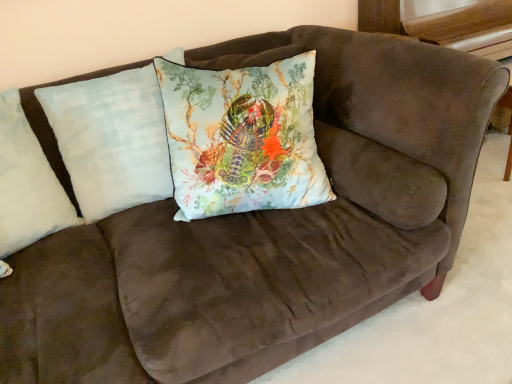
Image resolution: width=512 pixels, height=384 pixels. Identify the location of light blue fabric pillow at center, arranged as the 2th pillow when viewed from the right. (111, 140).

This screenshot has height=384, width=512. Describe the element at coordinates (242, 138) in the screenshot. I see `light blue fabric pillow at center, the third pillow in the left-to-right sequence` at that location.

Find the location of a particular element. Image resolution: width=512 pixels, height=384 pixels. white soft pillow at left, the first pillow viewed from the left is located at coordinates [x=26, y=185].

Can you confirm if light blue fabric pillow at center, arranged as the 2th pillow when viewed from the right, is bigger than white soft pillow at left, arranged as the third pillow when viewed from the right?

Indeed, light blue fabric pillow at center, arranged as the 2th pillow when viewed from the right, has a larger size compared to white soft pillow at left, arranged as the third pillow when viewed from the right.

From the image's perspective, would you say light blue fabric pillow at center, arranged as the 2th pillow when viewed from the right, is positioned over white soft pillow at left, the first pillow viewed from the left?

Yes, from the image's perspective, light blue fabric pillow at center, arranged as the 2th pillow when viewed from the right, is on top of white soft pillow at left, the first pillow viewed from the left.

How different are the orientations of light blue fabric pillow at center, the first pillow viewed from the right, and white soft pillow at left, arranged as the third pillow when viewed from the right, in degrees?

There is a 38.1-degree angle between the facing directions of light blue fabric pillow at center, the first pillow viewed from the right, and white soft pillow at left, arranged as the third pillow when viewed from the right.

Who is more distant, light blue fabric pillow at center, the third pillow in the left-to-right sequence, or white soft pillow at left, the first pillow viewed from the left?

light blue fabric pillow at center, the third pillow in the left-to-right sequence, is further away from the camera.

Considering the relative sizes of light blue fabric pillow at center, the first pillow viewed from the right, and white soft pillow at left, arranged as the third pillow when viewed from the right, in the image provided, is light blue fabric pillow at center, the first pillow viewed from the right, bigger than white soft pillow at left, arranged as the third pillow when viewed from the right,?

Yes.

Which object is more forward, light blue fabric pillow at center, positioned as the second pillow in left-to-right order, or light blue fabric pillow at center, the first pillow viewed from the right?

light blue fabric pillow at center, the first pillow viewed from the right, is more forward.

Which object is positioned more to the left, light blue fabric pillow at center, positioned as the second pillow in left-to-right order, or light blue fabric pillow at center, the third pillow in the left-to-right sequence?

light blue fabric pillow at center, positioned as the second pillow in left-to-right order, is more to the left.

From their relative heights in the image, would you say light blue fabric pillow at center, arranged as the 2th pillow when viewed from the right, is taller or shorter than light blue fabric pillow at center, the first pillow viewed from the right?

light blue fabric pillow at center, arranged as the 2th pillow when viewed from the right, is taller than light blue fabric pillow at center, the first pillow viewed from the right.

Is light blue fabric pillow at center, positioned as the second pillow in left-to-right order, completely or partially outside of light blue fabric pillow at center, the third pillow in the left-to-right sequence?

light blue fabric pillow at center, positioned as the second pillow in left-to-right order, lies outside light blue fabric pillow at center, the third pillow in the left-to-right sequence,'s area.

From a real-world perspective, which object stands above the other?

In real-world perspective, white soft pillow at left, the first pillow viewed from the left, is above.

Is white soft pillow at left, the first pillow viewed from the left, not close to light blue fabric pillow at center, the third pillow in the left-to-right sequence?

No, white soft pillow at left, the first pillow viewed from the left, is not far away from light blue fabric pillow at center, the third pillow in the left-to-right sequence.

How many degrees apart are the facing directions of white soft pillow at left, the first pillow viewed from the left, and light blue fabric pillow at center, the first pillow viewed from the right?

white soft pillow at left, the first pillow viewed from the left, and light blue fabric pillow at center, the first pillow viewed from the right, are facing 38.1 degrees away from each other.

How far apart are white soft pillow at left, the first pillow viewed from the left, and light blue fabric pillow at center, the first pillow viewed from the right?

white soft pillow at left, the first pillow viewed from the left, and light blue fabric pillow at center, the first pillow viewed from the right, are 22.98 inches apart.

Which of these two, light blue fabric pillow at center, the first pillow viewed from the right, or light blue fabric pillow at center, arranged as the 2th pillow when viewed from the right, stands taller?

light blue fabric pillow at center, arranged as the 2th pillow when viewed from the right.

From the image's perspective, is light blue fabric pillow at center, the third pillow in the left-to-right sequence, positioned above or below light blue fabric pillow at center, positioned as the second pillow in left-to-right order?

From the image's perspective, light blue fabric pillow at center, the third pillow in the left-to-right sequence, appears below light blue fabric pillow at center, positioned as the second pillow in left-to-right order.

Is light blue fabric pillow at center, the first pillow viewed from the right, oriented towards light blue fabric pillow at center, arranged as the 2th pillow when viewed from the right?

No.

Is light blue fabric pillow at center, the first pillow viewed from the right, bigger than light blue fabric pillow at center, arranged as the 2th pillow when viewed from the right?

Yes, light blue fabric pillow at center, the first pillow viewed from the right, is bigger than light blue fabric pillow at center, arranged as the 2th pillow when viewed from the right.

From the picture: Could light blue fabric pillow at center, positioned as the second pillow in left-to-right order, be considered to be inside white soft pillow at left, the first pillow viewed from the left?

No, light blue fabric pillow at center, positioned as the second pillow in left-to-right order, is not surrounded by white soft pillow at left, the first pillow viewed from the left.

Is there a large distance between white soft pillow at left, arranged as the third pillow when viewed from the right, and light blue fabric pillow at center, positioned as the second pillow in left-to-right order?

No, white soft pillow at left, arranged as the third pillow when viewed from the right, is not far away from light blue fabric pillow at center, positioned as the second pillow in left-to-right order.

Can you confirm if white soft pillow at left, arranged as the third pillow when viewed from the right, is wider than light blue fabric pillow at center, positioned as the second pillow in left-to-right order?

Indeed, white soft pillow at left, arranged as the third pillow when viewed from the right, has a greater width compared to light blue fabric pillow at center, positioned as the second pillow in left-to-right order.

Is white soft pillow at left, the first pillow viewed from the left, in front of or behind light blue fabric pillow at center, positioned as the second pillow in left-to-right order, in the image?

white soft pillow at left, the first pillow viewed from the left, is positioned closer to the viewer than light blue fabric pillow at center, positioned as the second pillow in left-to-right order.

Where is `the 2nd pillow above the light blue fabric pillow at center, positioned as the second pillow in left-to-right order (from a real-world perspective)`? the 2nd pillow above the light blue fabric pillow at center, positioned as the second pillow in left-to-right order (from a real-world perspective) is located at coordinates (26, 185).

Starting from the white soft pillow at left, the first pillow viewed from the left, which pillow is the 2nd one to the right? Please provide its 2D coordinates.

[(242, 138)]

From the image, which object appears to be farther from white soft pillow at left, arranged as the third pillow when viewed from the right, light blue fabric pillow at center, positioned as the second pillow in left-to-right order, or light blue fabric pillow at center, the third pillow in the left-to-right sequence?

Based on the image, light blue fabric pillow at center, the third pillow in the left-to-right sequence, appears to be further to white soft pillow at left, arranged as the third pillow when viewed from the right.

Considering their positions, is light blue fabric pillow at center, the first pillow viewed from the right, positioned closer to white soft pillow at left, the first pillow viewed from the left, than light blue fabric pillow at center, arranged as the 2th pillow when viewed from the right?

Result: Based on the image, light blue fabric pillow at center, arranged as the 2th pillow when viewed from the right, appears to be nearer to white soft pillow at left, the first pillow viewed from the left.

Which object lies nearer to the anchor point light blue fabric pillow at center, the first pillow viewed from the right, light blue fabric pillow at center, arranged as the 2th pillow when viewed from the right, or white soft pillow at left, arranged as the third pillow when viewed from the right?

light blue fabric pillow at center, arranged as the 2th pillow when viewed from the right, is positioned closer to the anchor light blue fabric pillow at center, the first pillow viewed from the right.

Which object lies nearer to the anchor point light blue fabric pillow at center, positioned as the second pillow in left-to-right order, white soft pillow at left, arranged as the third pillow when viewed from the right, or light blue fabric pillow at center, the first pillow viewed from the right?

Among the two, white soft pillow at left, arranged as the third pillow when viewed from the right, is located nearer to light blue fabric pillow at center, positioned as the second pillow in left-to-right order.

Looking at the image, which one is located further to light blue fabric pillow at center, the third pillow in the left-to-right sequence, white soft pillow at left, arranged as the third pillow when viewed from the right, or light blue fabric pillow at center, positioned as the second pillow in left-to-right order?

Among the two, white soft pillow at left, arranged as the third pillow when viewed from the right, is located further to light blue fabric pillow at center, the third pillow in the left-to-right sequence.

Based on the photo, considering their positions, is light blue fabric pillow at center, the third pillow in the left-to-right sequence, positioned closer to light blue fabric pillow at center, positioned as the second pillow in left-to-right order, than white soft pillow at left, the first pillow viewed from the left?

Among the two, white soft pillow at left, the first pillow viewed from the left, is located nearer to light blue fabric pillow at center, positioned as the second pillow in left-to-right order.

The height and width of the screenshot is (384, 512). In order to click on pillow situated between white soft pillow at left, arranged as the third pillow when viewed from the right, and light blue fabric pillow at center, the first pillow viewed from the right, from left to right in this screenshot , I will do `click(111, 140)`.